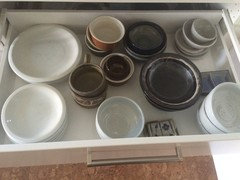
Identify the location of stck of white bowls. Image resolution: width=240 pixels, height=180 pixels. (42, 129).